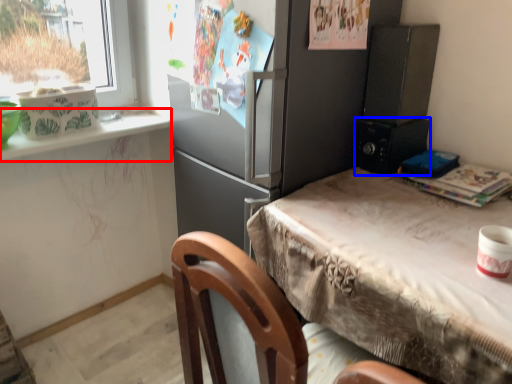
Question: Which object is closer to the camera taking this photo, window sill (highlighted by a red box) or appliance (highlighted by a blue box)?

Choices:
 (A) window sill
 (B) appliance

Answer: (A)